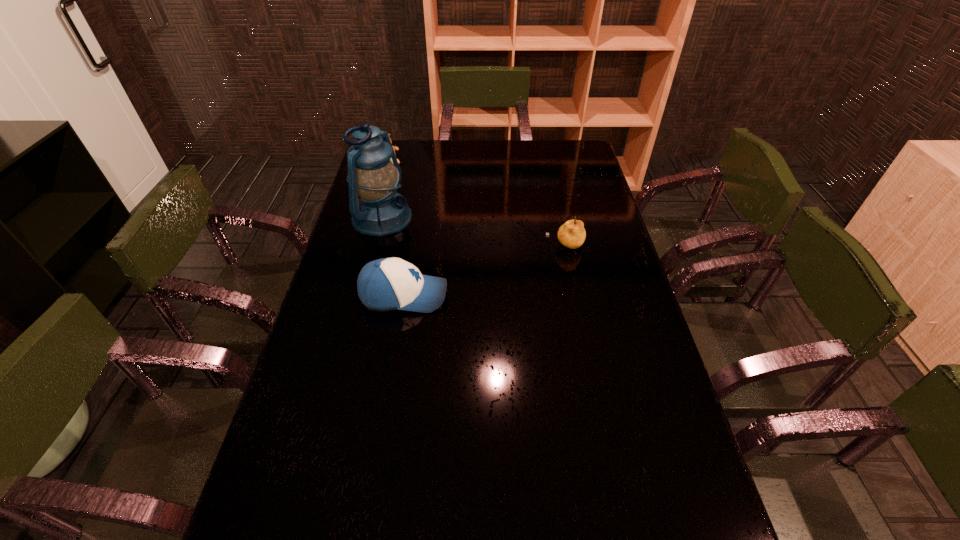
The width and height of the screenshot is (960, 540). In order to click on baseball cap in this screenshot , I will do `click(386, 284)`.

This screenshot has height=540, width=960. Find the location of `pear`. pear is located at coordinates (571, 234).

Where is `the tallest object`? This screenshot has width=960, height=540. the tallest object is located at coordinates (374, 176).

You are a GUI agent. You are given a task and a screenshot of the screen. Output one action in this format:
    pyautogui.click(x=<x>, y=<y>)
    Task: Click on the teddy bear
    This screenshot has width=960, height=540.
    Given the screenshot: What is the action you would take?
    pyautogui.click(x=394, y=147)

Find the location of a particular element. Image resolution: width=960 pixels, height=540 pixels. free region located 0.240m on the front-facing side of the nearest object is located at coordinates (529, 295).

Where is `free space located 0.170m on the left of the rightmost object`? free space located 0.170m on the left of the rightmost object is located at coordinates (493, 246).

Locate an element on the screen. This screenshot has width=960, height=540. vacant space positioned 0.260m on the face of the tallest object is located at coordinates (474, 254).

I want to click on vacant space situated 0.280m on the face of the tallest object, so click(x=479, y=256).

I want to click on vacant area situated 0.370m on the face of the tallest object, so click(505, 265).

What are the coordinates of `vacant space located on the front-facing side of the teddy bear` in the screenshot? It's located at (x=430, y=218).